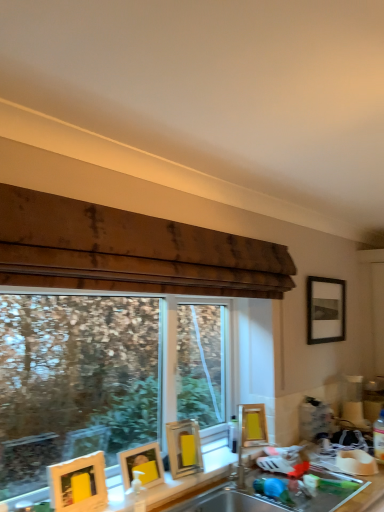
Image resolution: width=384 pixels, height=512 pixels. In order to click on vacant region in front of yellow matte picture frame at lower center, which is the 3th picture frame from right to left in this screenshot , I will do `click(181, 483)`.